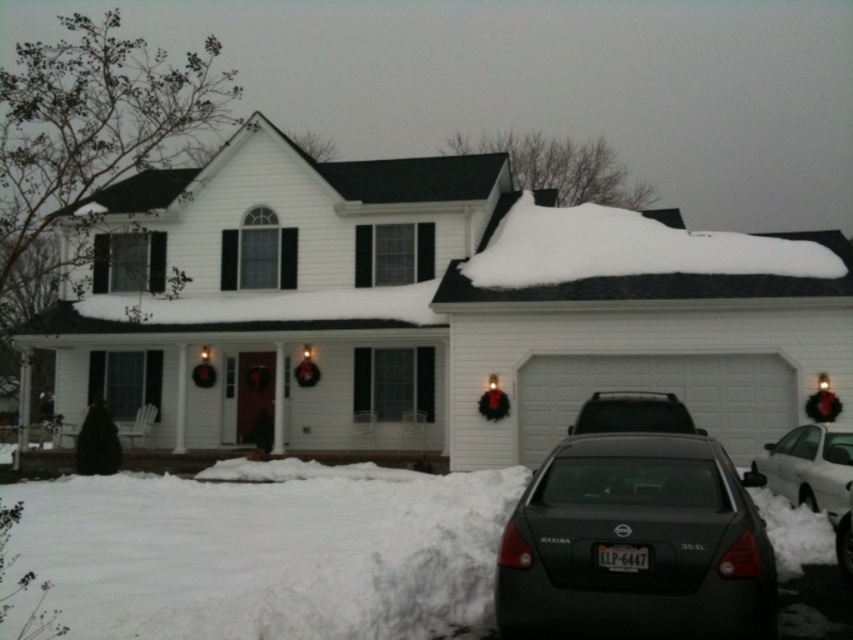
You are a delivery person arriving at this snowy house. You need to park your vehicle between the two sedans already present. The white glossy sedan at lower right is to the right of the dark gray metallic sedan at lower center. Where should you park your car to ensure it is between them?

To park between the white glossy sedan at lower right and the dark gray metallic sedan at lower center, you should position your car between them, ensuring it is to the left of the white glossy sedan at lower right and to the right of the dark gray metallic sedan at lower center.

You are a delivery person arriving at the house and need to park your vehicle. You see a matte black sedan at lower right and a white glossy sedan at lower right. Which vehicle should you move first to access the driveway?

The matte black sedan at lower right is in front of the white glossy sedan at lower right, so you should move the matte black sedan at lower right first to access the driveway.

You are a delivery person trying to park your truck next to the matte black sedan at lower right and the white fluffy snow at upper right. Which area has enough space for your truck, which is wider than the sedan?

The white fluffy snow at upper right has more width than the matte black sedan at lower right, so the truck can park there.